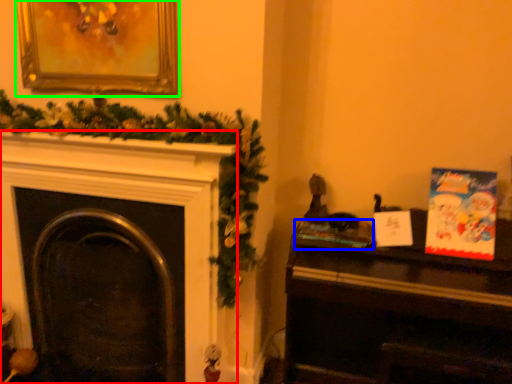
Question: Which object is positioned closest to fireplace (highlighted by a red box)? Select from book (highlighted by a blue box) and picture frame (highlighted by a green box).

Choices:
 (A) book
 (B) picture frame

Answer: (B)